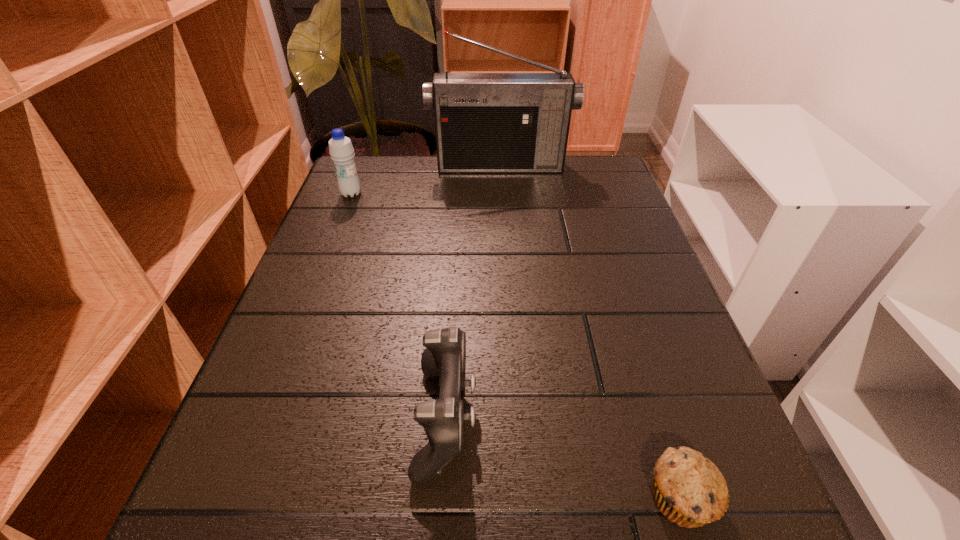
Where is `radio receiver positioned at the far edge`? This screenshot has height=540, width=960. radio receiver positioned at the far edge is located at coordinates (484, 122).

Identify the location of water bottle that is at the far edge. The height and width of the screenshot is (540, 960). (341, 151).

Locate an element on the screen. The height and width of the screenshot is (540, 960). control positioned at the near edge is located at coordinates (443, 419).

What are the coordinates of `muffin located at the near edge` in the screenshot? It's located at click(x=689, y=490).

Identify the location of object located in the left edge section of the desktop. The image size is (960, 540). (341, 151).

Locate an element on the screen. This screenshot has height=540, width=960. radio receiver at the right edge is located at coordinates (484, 122).

What are the coordinates of `muffin positioned at the right edge` in the screenshot? It's located at (689, 490).

In order to click on object positioned at the far left corner in this screenshot , I will do `click(341, 151)`.

Image resolution: width=960 pixels, height=540 pixels. I want to click on object at the far right corner, so click(x=484, y=122).

Find the location of `object that is at the near right corner`. object that is at the near right corner is located at coordinates (689, 490).